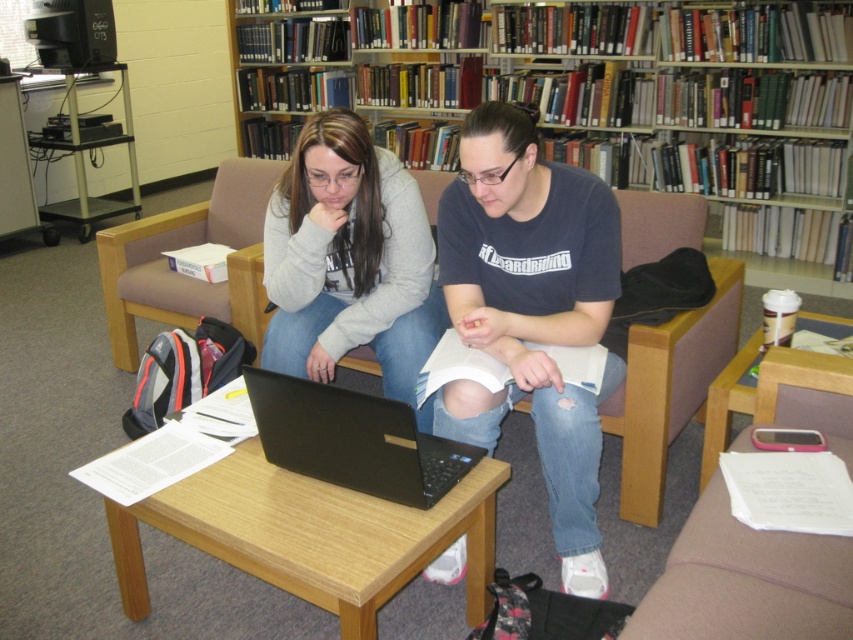
Question: Can you confirm if matte black laptop at center is positioned to the left of wooden table at center?

Choices:
 (A) yes
 (B) no

Answer: (B)

Question: Estimate the real-world distances between objects in this image. Which object is closer to the wooden bookcase at upper center?

Choices:
 (A) black matte laptop at center
 (B) matte black laptop at center

Answer: (B)

Question: Can you confirm if wooden bookcase at upper center is positioned below beige fabric armchair at left?

Choices:
 (A) no
 (B) yes

Answer: (A)

Question: Is matte black laptop at center to the left of wooden bookcase at upper center from the viewer's perspective?

Choices:
 (A) yes
 (B) no

Answer: (A)

Question: Estimate the real-world distances between objects in this image. Which object is closer to the wooden table at center?

Choices:
 (A) beige fabric armchair at left
 (B) black matte laptop at center
 (C) pink plastic phone at lower right
 (D) wooden bookcase at upper center

Answer: (B)

Question: Among these objects, which one is nearest to the camera?

Choices:
 (A) pink fabric armchair at lower right
 (B) wooden bookcase at upper center
 (C) pink plastic phone at lower right

Answer: (A)